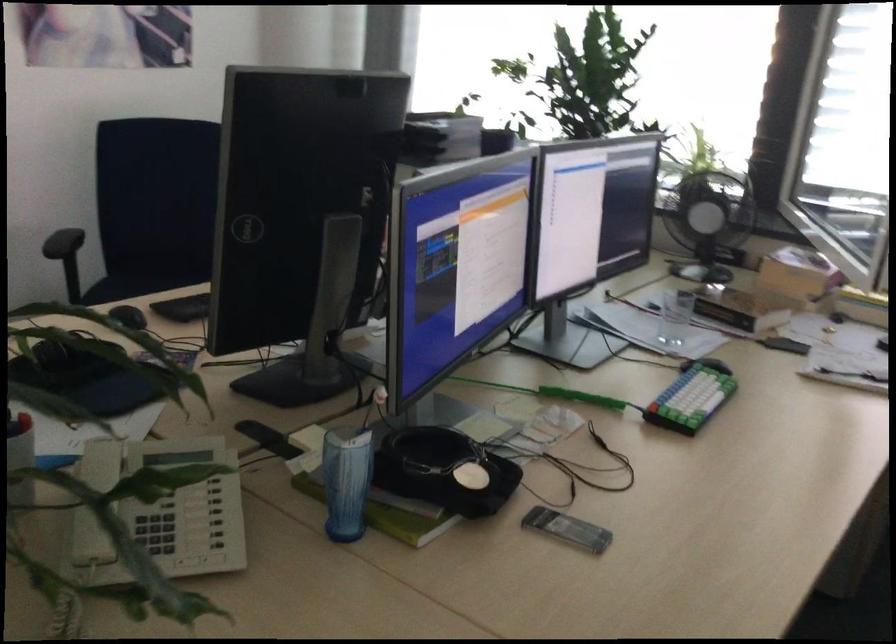
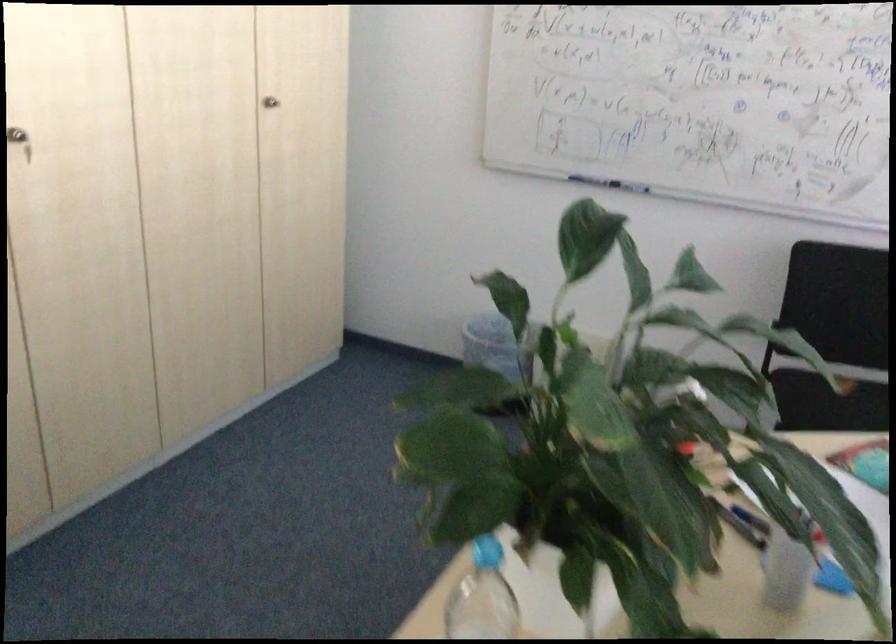
Question: How did the camera likely rotate?

Choices:
 (A) Left
 (B) Right
 (C) Up
 (D) Down

Answer: (A)